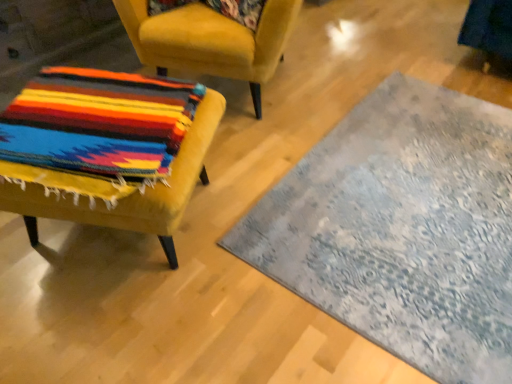
Question: Considering the positions of multicolored woven fabric at left, the 1th chair in the top-to-bottom sequence, and velvet yellow chair at left, the 2th chair when ordered from top to bottom, in the image, is multicolored woven fabric at left, the 1th chair in the top-to-bottom sequence, taller or shorter than velvet yellow chair at left, the 2th chair when ordered from top to bottom,?

Choices:
 (A) tall
 (B) short

Answer: (A)

Question: Is multicolored woven fabric at left, the 2th chair positioned from the bottom, situated inside velvet yellow chair at left, the 2th chair when ordered from top to bottom, or outside?

Choices:
 (A) outside
 (B) inside

Answer: (A)

Question: Estimate the real-world distances between objects in this image. Which object is farther from the multicolored woven fabric at left, the 1th chair in the top-to-bottom sequence?

Choices:
 (A) velvet yellow chair at left, the 1th chair from the bottom
 (B) floral fabric pillow at upper center
 (C) textured gray rug at center

Answer: (C)

Question: Which object is positioned farthest from the multicolored woven fabric at left, the 2th chair positioned from the bottom?

Choices:
 (A) velvet yellow chair at left, the 2th chair when ordered from top to bottom
 (B) textured gray rug at center
 (C) floral fabric pillow at upper center

Answer: (B)